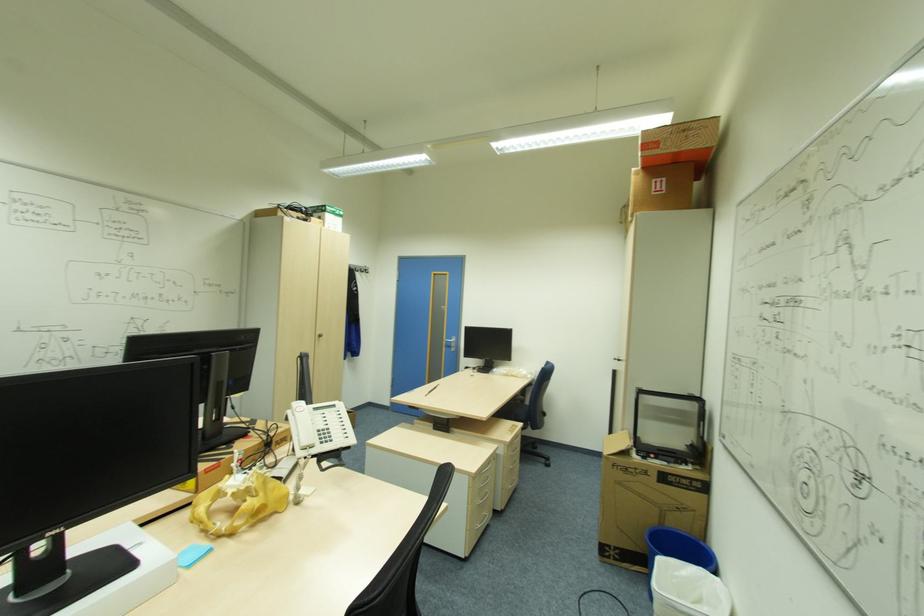
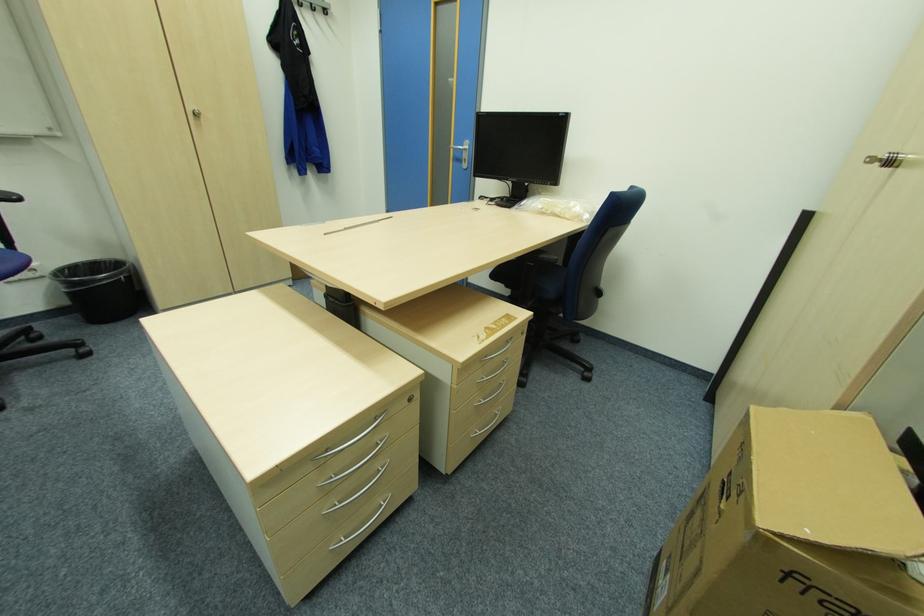
Locate, in the second image, the point that corresponds to (x=456, y=341) in the first image.

(468, 148)